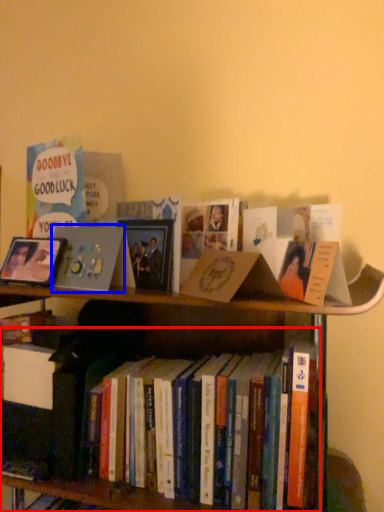
Question: Among these objects, which one is farthest to the camera, book (highlighted by a red box) or book cover (highlighted by a blue box)?

Choices:
 (A) book
 (B) book cover

Answer: (B)